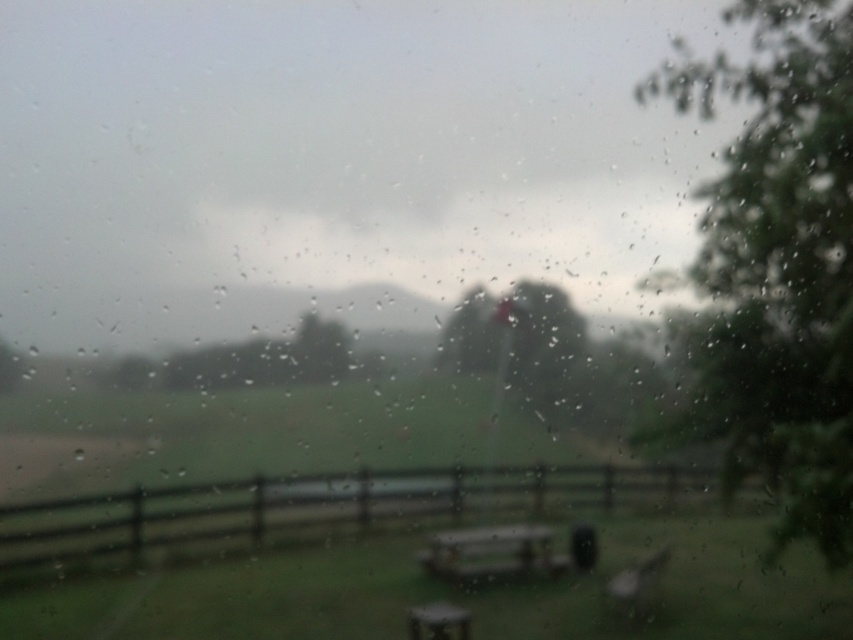
Question: Among these points, which one is farthest from the camera?

Choices:
 (A) (299, 356)
 (B) (781, 518)
 (C) (36, 502)
 (D) (503, 566)

Answer: (B)

Question: Does brown wooden fence at lower center have a larger size compared to green matte tree at center?

Choices:
 (A) no
 (B) yes

Answer: (B)

Question: Is green leafy tree at right thinner than brown wooden fence at lower center?

Choices:
 (A) yes
 (B) no

Answer: (A)

Question: Which point is closer to the camera taking this photo?

Choices:
 (A) (750, 188)
 (B) (625, 500)

Answer: (A)

Question: Is green leafy tree at right bigger than brown wooden fence at lower center?

Choices:
 (A) no
 (B) yes

Answer: (A)

Question: Among these objects, which one is farthest from the camera?

Choices:
 (A) green matte tree at center
 (B) green leafy tree at right

Answer: (B)